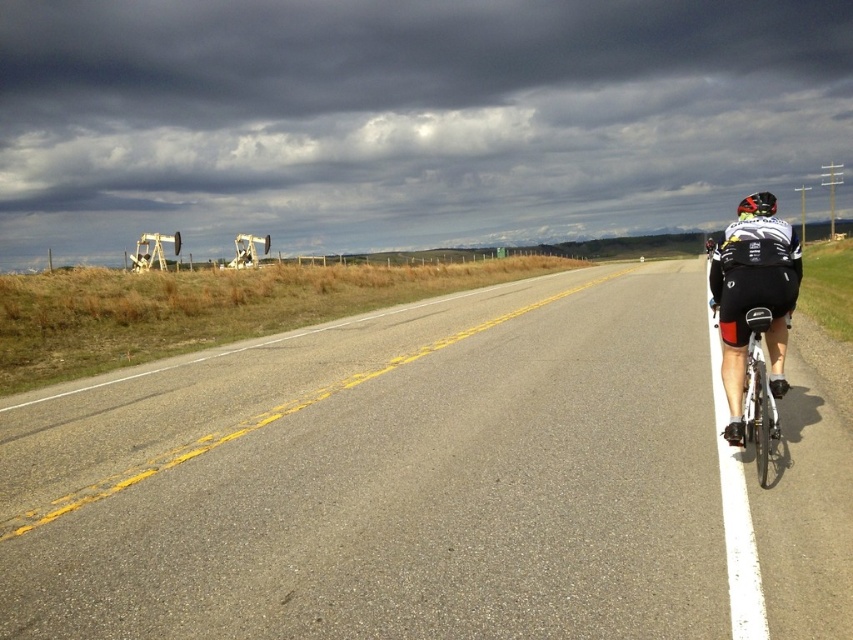
Does black matte cycling jersey at right have a lesser height compared to white metallic bicycle at right?

No.

Is black matte cycling jersey at right further to camera compared to white metallic bicycle at right?

That is True.

I want to click on black matte cycling jersey at right, so click(753, 301).

Which is more to the left, asphalt road at center or black matte cycling jersey at right?

From the viewer's perspective, asphalt road at center appears more on the left side.

Can you confirm if asphalt road at center is positioned to the left of black matte cycling jersey at right?

Yes, asphalt road at center is to the left of black matte cycling jersey at right.

This screenshot has height=640, width=853. I want to click on asphalt road at center, so click(428, 481).

Does black matte cycling jersey at right have a lesser width compared to shiny black helmet at right?

Yes, black matte cycling jersey at right is thinner than shiny black helmet at right.

At what (x,y) coordinates should I click in order to perform the action: click on black matte cycling jersey at right. Please return your answer as a coordinate pair (x, y). The width and height of the screenshot is (853, 640). Looking at the image, I should click on (753, 301).

The width and height of the screenshot is (853, 640). In order to click on black matte cycling jersey at right in this screenshot , I will do `click(753, 301)`.